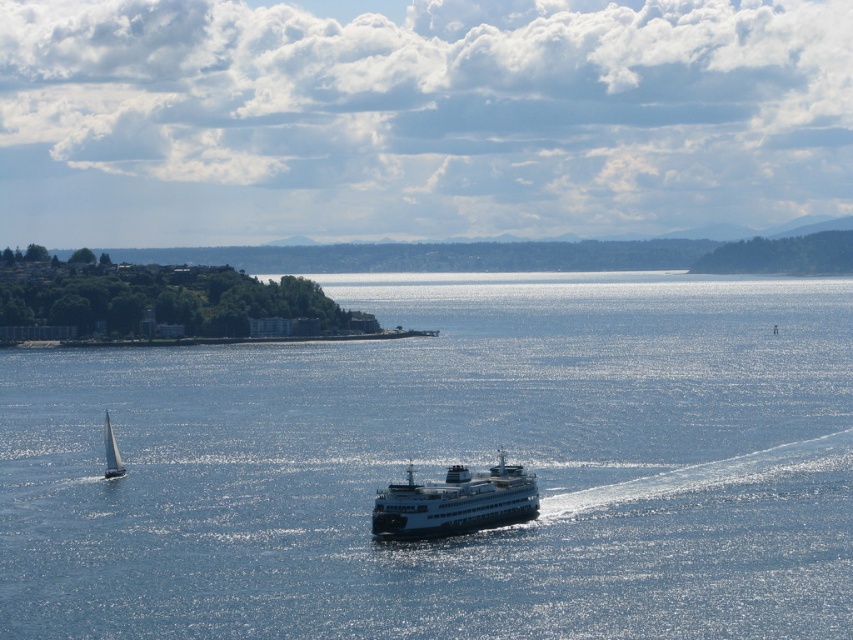
Between point (281, 621) and point (393, 515), which one is positioned in front?

Positioned in front is point (281, 621).

Is point (734, 467) positioned after point (482, 486)?

Yes, point (734, 467) is behind point (482, 486).

Is point (135, 497) less distant than point (415, 502)?

That is False.

I want to click on blue water at center, so click(x=447, y=465).

Which is below, blue water at center or white glossy sailboat at lower left?

white glossy sailboat at lower left

Find the location of a particular element. Image resolution: width=853 pixels, height=640 pixels. blue water at center is located at coordinates (447, 465).

Between point (589, 333) and point (103, 444), which one is positioned behind?

The point (589, 333) is behind.

You are a GUI agent. You are given a task and a screenshot of the screen. Output one action in this format:
    pyautogui.click(x=<x>, y=<y>)
    Task: Click on the blue water at center
    This screenshot has height=640, width=853.
    Given the screenshot: What is the action you would take?
    [x=447, y=465]

Can you confirm if white glossy ferry at center is shorter than white glossy sailboat at lower left?

Incorrect, white glossy ferry at center's height does not fall short of white glossy sailboat at lower left's.

Who is higher up, white glossy ferry at center or white glossy sailboat at lower left?

white glossy sailboat at lower left is above.

Find the location of a particular element. white glossy ferry at center is located at coordinates (456, 502).

Where is `white glossy ferry at center`? white glossy ferry at center is located at coordinates (456, 502).